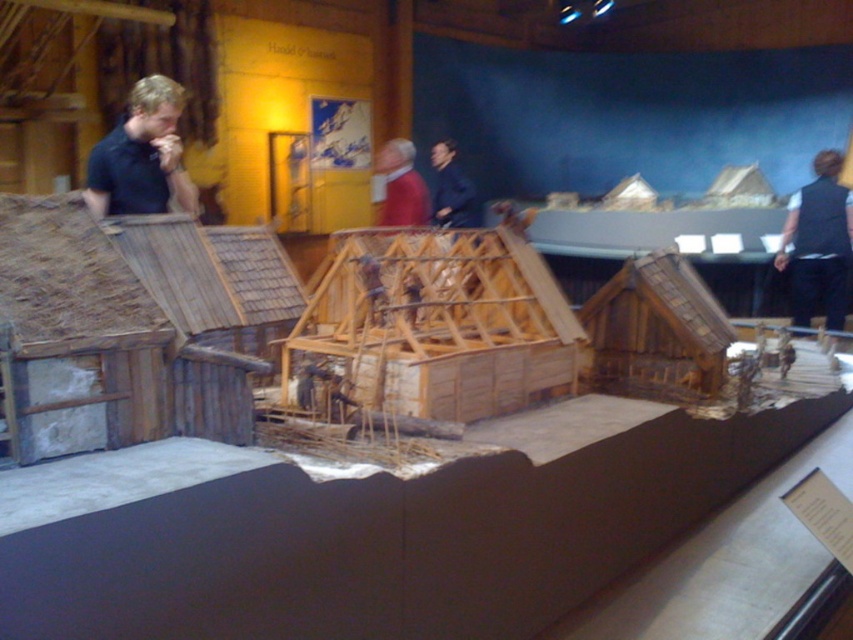
Can you confirm if black vest at right is positioned to the right of red sweater at center?

Indeed, black vest at right is positioned on the right side of red sweater at center.

Is black vest at right below red sweater at center?

Correct, black vest at right is located below red sweater at center.

Identify the location of black vest at right. (817, 243).

Which is below, thatched wood hut at left or matte black shirt at left?

Positioned lower is thatched wood hut at left.

Does thatched wood hut at left have a lesser width compared to matte black shirt at left?

No.

You are a GUI agent. You are given a task and a screenshot of the screen. Output one action in this format:
    pyautogui.click(x=<x>, y=<y>)
    Task: Click on the thatched wood hut at left
    This screenshot has width=853, height=640.
    Given the screenshot: What is the action you would take?
    pyautogui.click(x=136, y=324)

The height and width of the screenshot is (640, 853). Describe the element at coordinates (136, 324) in the screenshot. I see `thatched wood hut at left` at that location.

Between thatched wood hut at left and black vest at right, which one is positioned lower?

thatched wood hut at left

Does point (48, 321) come behind point (816, 240)?

That is False.

Where is `thatched wood hut at left`? The image size is (853, 640). thatched wood hut at left is located at coordinates (136, 324).